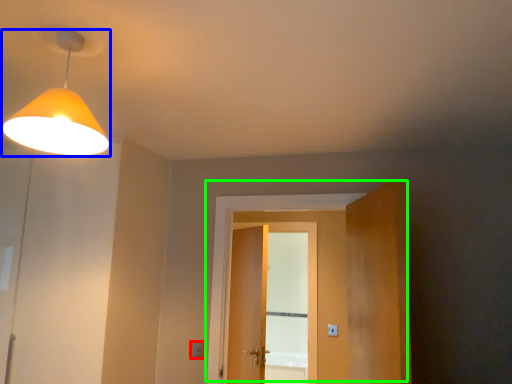
Question: Considering the real-world distances, which object is closest to light switch (highlighted by a red box)? lamp (highlighted by a blue box) or door (highlighted by a green box).

Choices:
 (A) lamp
 (B) door

Answer: (B)